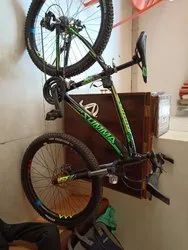
This screenshot has height=250, width=188. What are the coordinates of `seat` in the screenshot? It's located at (141, 45).